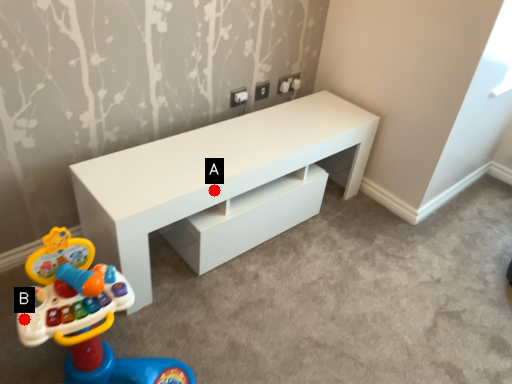
Question: Two points are circled on the image, labeled by A and B beside each circle. Among these points, which one is nearest to the camera?

Choices:
 (A) A is closer
 (B) B is closer

Answer: (B)